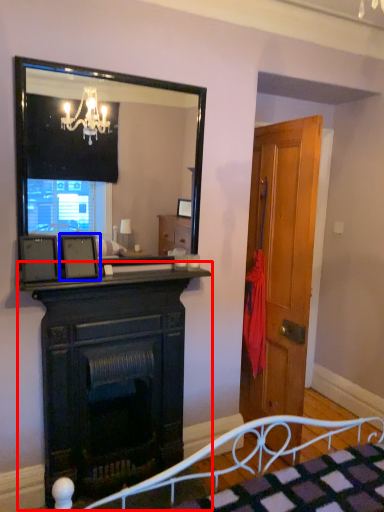
Question: Which object appears closest to the camera in this image, fireplace (highlighted by a red box) or picture frame (highlighted by a blue box)?

Choices:
 (A) fireplace
 (B) picture frame

Answer: (A)